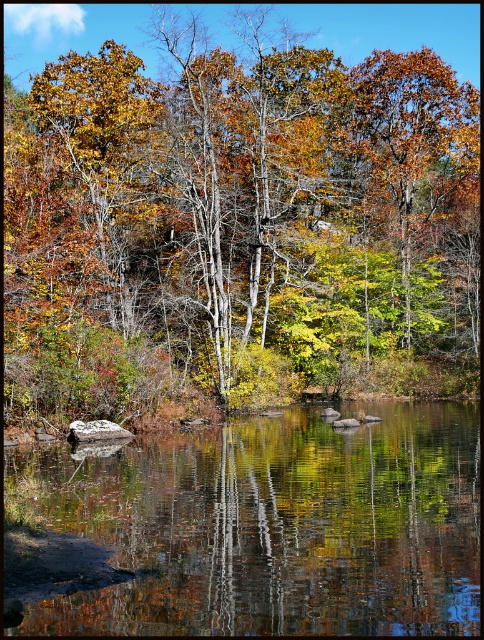
Question: Is green leafy tree at center smaller than reflective smooth water at center?

Choices:
 (A) yes
 (B) no

Answer: (B)

Question: Is green leafy tree at center above reflective smooth water at center?

Choices:
 (A) no
 (B) yes

Answer: (B)

Question: Does green leafy tree at center have a larger size compared to reflective smooth water at center?

Choices:
 (A) yes
 (B) no

Answer: (A)

Question: Among these points, which one is farthest from the camera?

Choices:
 (A) (272, 332)
 (B) (144, 516)

Answer: (A)